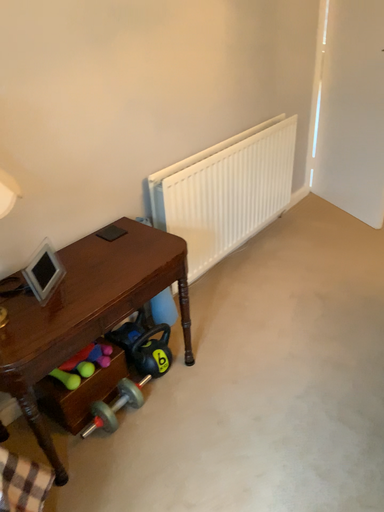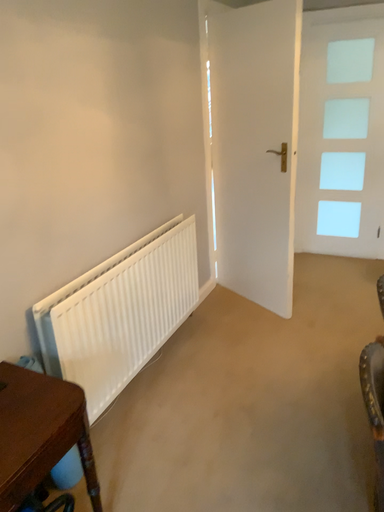
Question: Which way did the camera rotate in the video?

Choices:
 (A) rotated downward
 (B) rotated upward

Answer: (B)